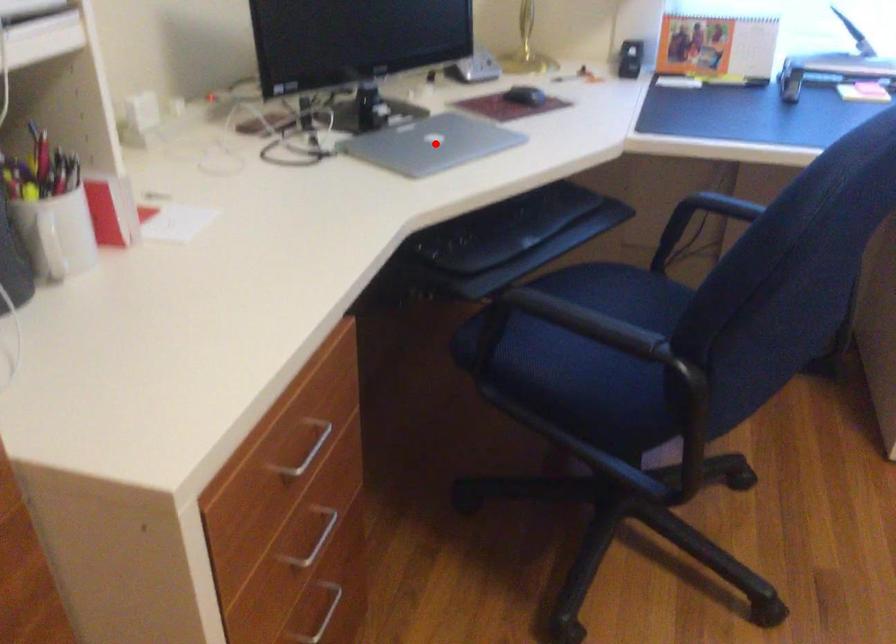
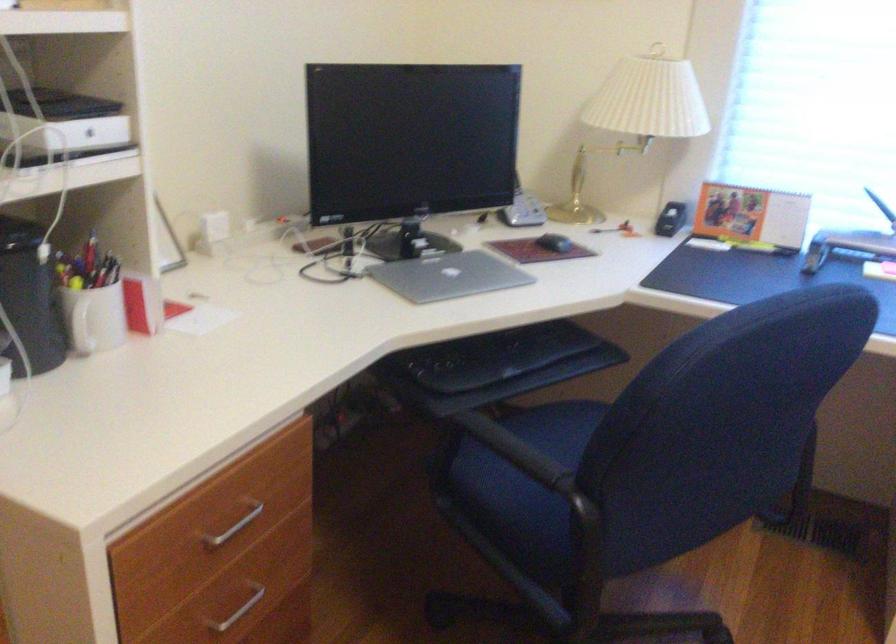
Where in the second image is the point corresponding to the highlighted location from the first image?

(449, 276)